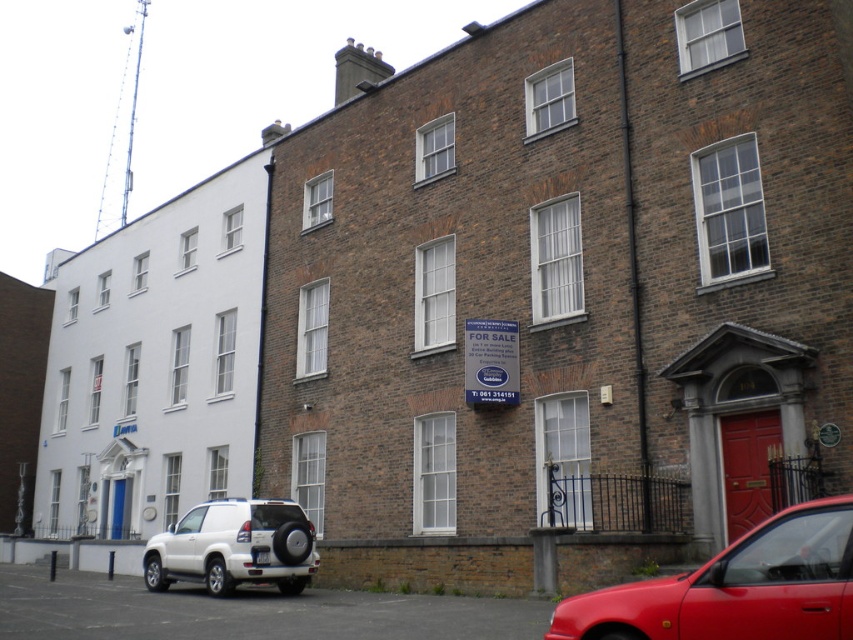
Which of these two, white matte suv at lower left or white plastic license plate at center, stands shorter?

Standing shorter between the two is white plastic license plate at center.

Does white matte suv at lower left have a greater height compared to white plastic license plate at center?

Correct, white matte suv at lower left is much taller as white plastic license plate at center.

Is point (276, 566) closer to viewer compared to point (267, 563)?

No, it is not.

Image resolution: width=853 pixels, height=640 pixels. In order to click on white matte suv at lower left in this screenshot , I will do `click(233, 547)`.

Does shiny red car at lower right have a greater height compared to white plastic license plate at center?

Yes.

Is shiny red car at lower right further to camera compared to white plastic license plate at center?

No, shiny red car at lower right is in front of white plastic license plate at center.

Identify the location of shiny red car at lower right. (735, 588).

This screenshot has width=853, height=640. Find the location of `shiny red car at lower right`. shiny red car at lower right is located at coordinates (735, 588).

Who is positioned more to the right, shiny red car at lower right or white matte suv at lower left?

shiny red car at lower right is more to the right.

Identify the location of shiny red car at lower right. The width and height of the screenshot is (853, 640). (735, 588).